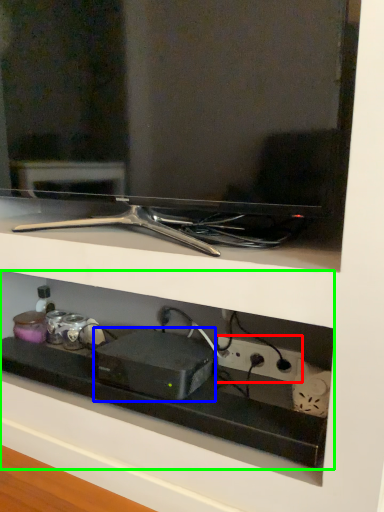
Question: Which is nearer to the electric outlet (highlighted by a red box)? appliance (highlighted by a blue box) or shelf (highlighted by a green box).

Choices:
 (A) appliance
 (B) shelf

Answer: (A)